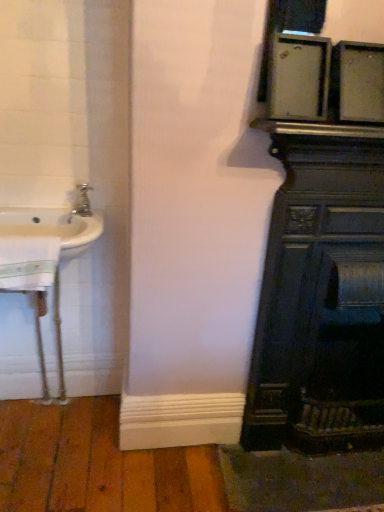
Question: Is brushed metal faucet at left in front of or behind white glossy sink at left in the image?

Choices:
 (A) behind
 (B) front

Answer: (A)

Question: From the image's perspective, is brushed metal faucet at left above or below white glossy sink at left?

Choices:
 (A) above
 (B) below

Answer: (A)

Question: Estimate the real-world distances between objects in this image. Which object is closer to the brushed metal faucet at left?

Choices:
 (A) white glossy sink at left
 (B) dark wood fireplace at right

Answer: (A)

Question: Estimate the real-world distances between objects in this image. Which object is farther from the brushed metal faucet at left?

Choices:
 (A) white glossy sink at left
 (B) dark wood fireplace at right

Answer: (B)